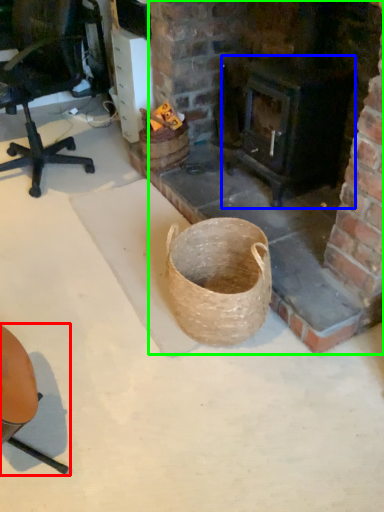
Question: Estimate the real-world distances between objects in this image. Which object is closer to chair (highlighted by a red box), stove (highlighted by a blue box) or fireplace (highlighted by a green box)?

Choices:
 (A) stove
 (B) fireplace

Answer: (B)